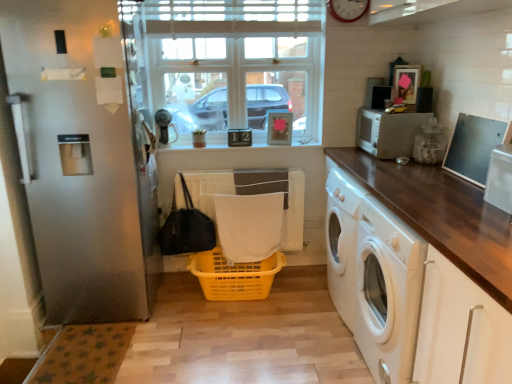
Question: Is wooden clock at upper center facing away from metallic silver microwave at right?

Choices:
 (A) yes
 (B) no

Answer: (B)

Question: Is wooden clock at upper center shorter than metallic silver microwave at right?

Choices:
 (A) yes
 (B) no

Answer: (B)

Question: Is wooden clock at upper center not within metallic silver microwave at right?

Choices:
 (A) no
 (B) yes

Answer: (B)

Question: Considering the relative positions of wooden clock at upper center and metallic silver microwave at right in the image provided, is wooden clock at upper center to the left of metallic silver microwave at right from the viewer's perspective?

Choices:
 (A) yes
 (B) no

Answer: (A)

Question: From the image's perspective, would you say wooden clock at upper center is positioned over metallic silver microwave at right?

Choices:
 (A) no
 (B) yes

Answer: (B)

Question: Considering the relative sizes of wooden clock at upper center and metallic silver microwave at right in the image provided, is wooden clock at upper center wider than metallic silver microwave at right?

Choices:
 (A) yes
 (B) no

Answer: (A)

Question: Is yellow plastic basket at center looking in the opposite direction of white glass window at center?

Choices:
 (A) no
 (B) yes

Answer: (A)

Question: From a real-world perspective, is yellow plastic basket at center on top of white glass window at center?

Choices:
 (A) yes
 (B) no

Answer: (B)

Question: From a real-world perspective, is yellow plastic basket at center positioned under white glass window at center based on gravity?

Choices:
 (A) no
 (B) yes

Answer: (B)

Question: Does yellow plastic basket at center turn towards white glass window at center?

Choices:
 (A) yes
 (B) no

Answer: (B)

Question: From the image's perspective, does yellow plastic basket at center appear lower than white glass window at center?

Choices:
 (A) no
 (B) yes

Answer: (B)

Question: Considering the relative sizes of yellow plastic basket at center and white glass window at center in the image provided, is yellow plastic basket at center thinner than white glass window at center?

Choices:
 (A) no
 (B) yes

Answer: (A)

Question: Is white matte microwave at upper right turned away from yellow plastic basket at center?

Choices:
 (A) no
 (B) yes

Answer: (A)